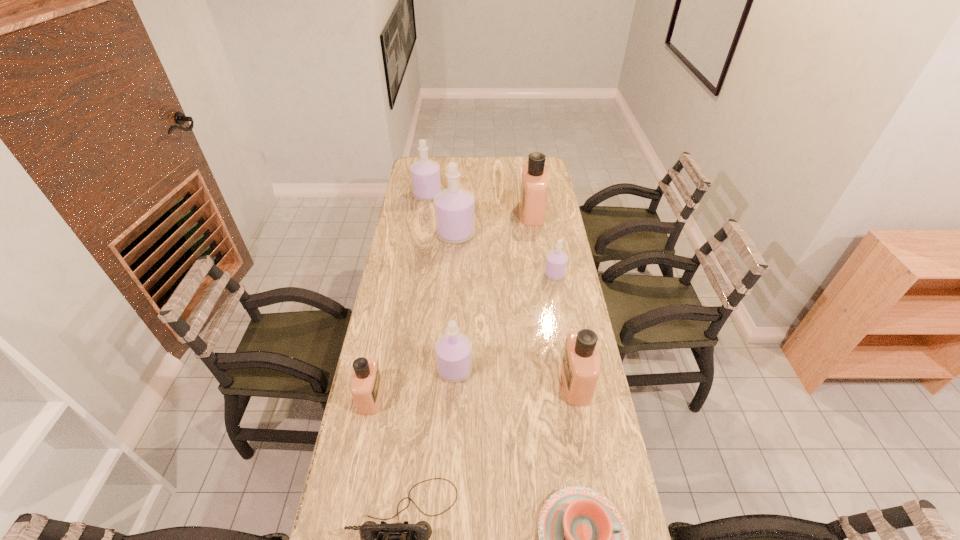
Image resolution: width=960 pixels, height=540 pixels. What are the coordinates of `the tallest object` in the screenshot? It's located at (x=454, y=207).

I want to click on the biggest purple perfume, so click(454, 207).

This screenshot has height=540, width=960. Identify the location of the farthest beige perfume. (534, 186).

Where is `the third smallest purple perfume`? the third smallest purple perfume is located at coordinates (425, 174).

I want to click on the third biggest purple perfume, so click(x=453, y=350).

Locate an element on the screen. The width and height of the screenshot is (960, 540). the second biggest beige perfume is located at coordinates (580, 367).

The width and height of the screenshot is (960, 540). Identify the location of the sixth nearest object. click(x=556, y=262).

Find the location of a particular element. The image size is (960, 540). the second nearest purple perfume is located at coordinates (556, 262).

Identify the location of the smallest beige perfume. (366, 385).

Image resolution: width=960 pixels, height=540 pixels. Find the location of `free region located on the back of the tallest perfume`. free region located on the back of the tallest perfume is located at coordinates (457, 210).